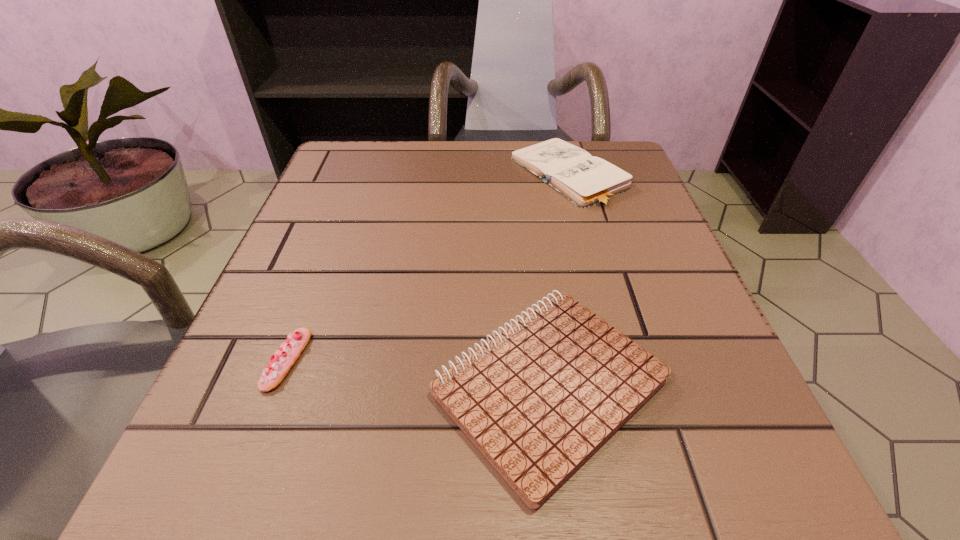
Find the location of `free space between the eclair and the farther notebook`. free space between the eclair and the farther notebook is located at coordinates (428, 268).

Where is `empty location between the farthest object and the eclair`? Image resolution: width=960 pixels, height=540 pixels. empty location between the farthest object and the eclair is located at coordinates (428, 268).

Locate an element on the screen. free spot between the eclair and the farthest object is located at coordinates (428, 268).

This screenshot has width=960, height=540. I want to click on free space between the nearer notebook and the farthest object, so [559, 280].

Identify the location of vacant point located between the leftmost object and the farthest object. The image size is (960, 540). (428, 268).

The width and height of the screenshot is (960, 540). I want to click on free space that is in between the farther notebook and the leftmost object, so (x=428, y=268).

This screenshot has width=960, height=540. Identify the location of free spot between the nearer notebook and the eclair. [x=419, y=372].

Identify the location of blank region between the leftmost object and the farthest object. (428, 268).

Find the location of `the second closest object to the nearer notebook`. the second closest object to the nearer notebook is located at coordinates (587, 181).

Find the location of a particular element. object that is the second closest to the leftmost object is located at coordinates (587, 181).